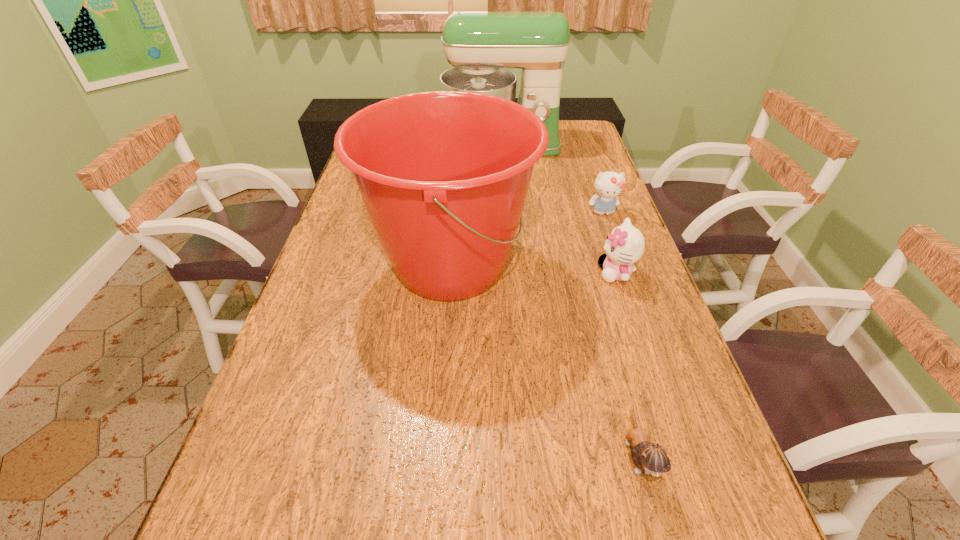
You are a GUI agent. You are given a task and a screenshot of the screen. Output one action in this format:
    pyautogui.click(x=<x>, y=<y>)
    Task: Click on the vacant area located 0.330m on the front-facing side of the second farthest kitten
    The image size is (960, 540).
    Given the screenshot: What is the action you would take?
    pyautogui.click(x=470, y=273)

The width and height of the screenshot is (960, 540). I want to click on blank space located 0.160m on the front-facing side of the farthest kitten, so click(x=617, y=254).

The height and width of the screenshot is (540, 960). In order to click on free point located 0.060m on the front-facing side of the leftmost kitten in this screenshot , I will do `click(659, 536)`.

Where is `object that is at the far edge`? object that is at the far edge is located at coordinates (480, 45).

The width and height of the screenshot is (960, 540). Find the location of `object that is at the left edge`. object that is at the left edge is located at coordinates (444, 175).

This screenshot has height=540, width=960. What are the coordinates of `mixer present at the right edge` in the screenshot? It's located at click(x=480, y=45).

Find the location of a particular element. object that is at the far right corner is located at coordinates click(480, 45).

Identify the location of vacant space at the left edge of the desktop. (289, 469).

At what (x,y) coordinates should I click in order to perform the action: click on blank space at the right edge of the desktop. Please return your answer as a coordinate pair (x, y). Looking at the image, I should click on (684, 415).

You are a GUI agent. You are given a task and a screenshot of the screen. Output one action in this format:
    pyautogui.click(x=<x>, y=<y>)
    Task: Click on the vacant region at the far right corner of the desktop
    
    Given the screenshot: What is the action you would take?
    tap(574, 119)